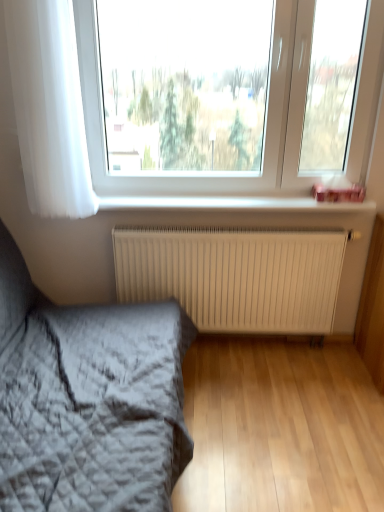
Question: From the image's perspective, is textured gray quilt at lower left under white plastic window sill at upper center?

Choices:
 (A) yes
 (B) no

Answer: (A)

Question: Are textured gray quilt at lower left and white plastic window sill at upper center located far from each other?

Choices:
 (A) yes
 (B) no

Answer: (B)

Question: From the image's perspective, is textured gray quilt at lower left on white plastic window sill at upper center?

Choices:
 (A) yes
 (B) no

Answer: (B)

Question: Can you confirm if textured gray quilt at lower left is positioned to the right of white plastic window sill at upper center?

Choices:
 (A) no
 (B) yes

Answer: (A)

Question: From a real-world perspective, is textured gray quilt at lower left over white plastic window sill at upper center?

Choices:
 (A) no
 (B) yes

Answer: (A)

Question: Does textured gray quilt at lower left have a lesser width compared to white plastic window sill at upper center?

Choices:
 (A) yes
 (B) no

Answer: (B)

Question: Is white matte radiator at center taller than white sheer curtain at left?

Choices:
 (A) yes
 (B) no

Answer: (B)

Question: Is white matte radiator at center outside white sheer curtain at left?

Choices:
 (A) yes
 (B) no

Answer: (A)

Question: From the image's perspective, is white matte radiator at center under white sheer curtain at left?

Choices:
 (A) no
 (B) yes

Answer: (B)

Question: Is there a large distance between white matte radiator at center and white sheer curtain at left?

Choices:
 (A) yes
 (B) no

Answer: (B)

Question: Is white matte radiator at center positioned in front of white sheer curtain at left?

Choices:
 (A) yes
 (B) no

Answer: (B)

Question: Is white matte radiator at center at the left side of white sheer curtain at left?

Choices:
 (A) yes
 (B) no

Answer: (B)

Question: Is white matte radiator at center further to the viewer compared to white plastic window sill at upper center?

Choices:
 (A) no
 (B) yes

Answer: (B)